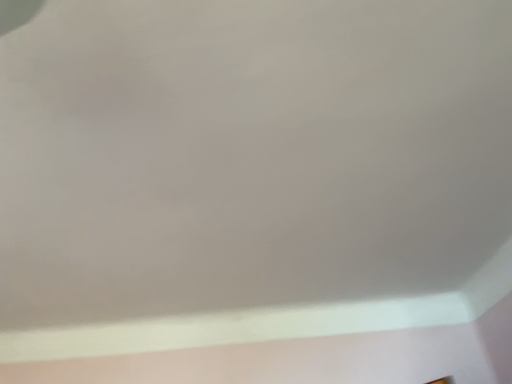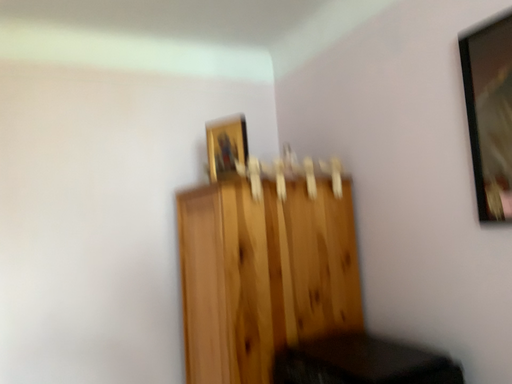
Question: Which way did the camera rotate in the video?

Choices:
 (A) rotated upward
 (B) rotated downward

Answer: (B)